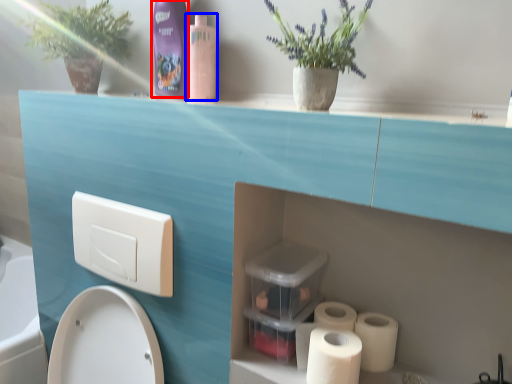
Question: Which of the following is the closest to the observer, cleaning product (highlighted by a red box) or cleaning product (highlighted by a blue box)?

Choices:
 (A) cleaning product
 (B) cleaning product

Answer: (B)